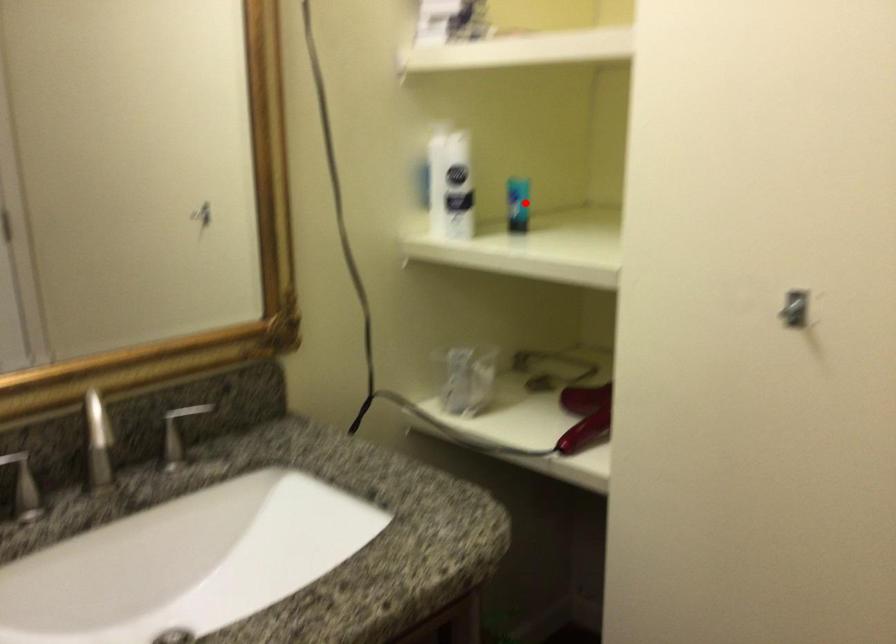
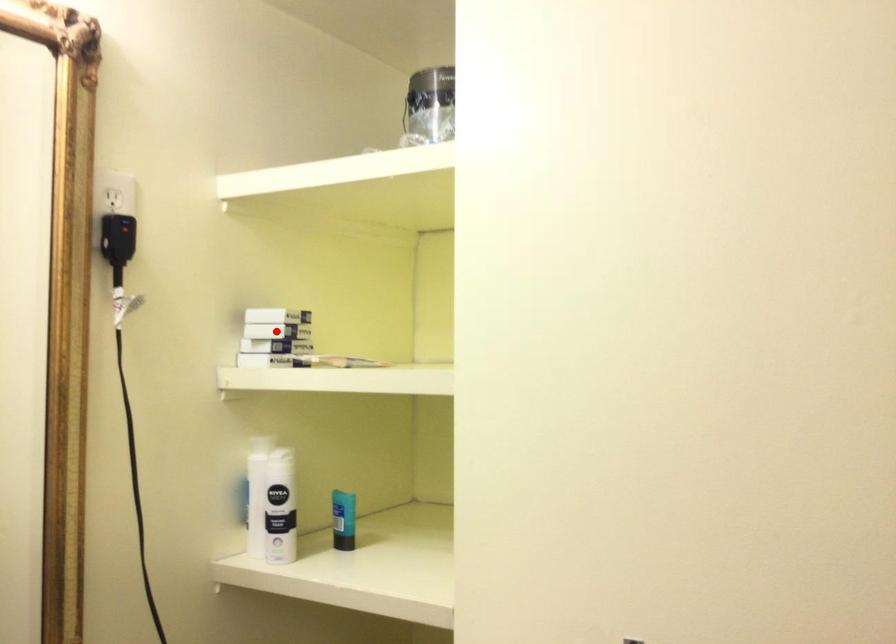
I am providing you with two images of the same scene from different viewpoints. A red point is marked on the first image and another point is marked on the second image. Do the highlighted points in image1 and image2 indicate the same real-world spot?

No